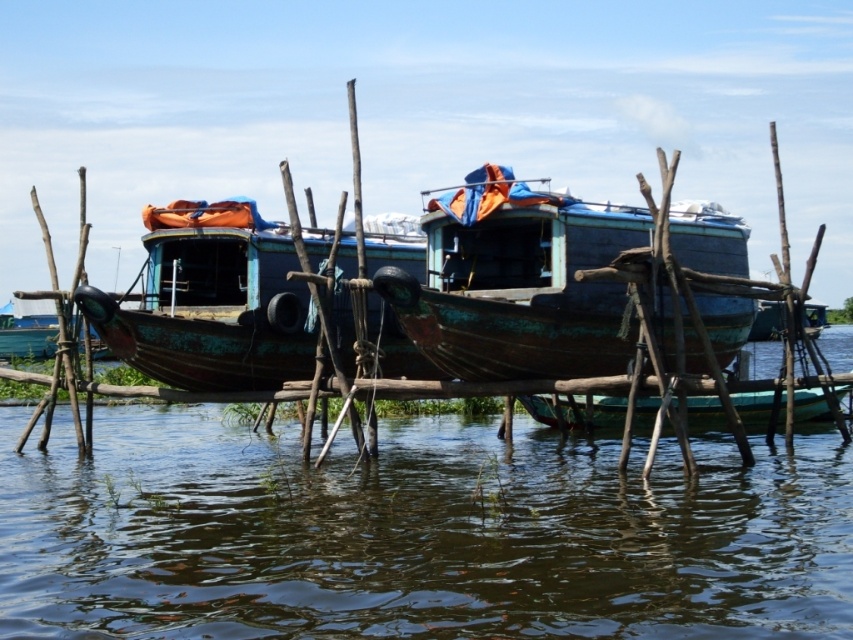
Which of these two, rusty wood boat at center or rusty metal boat at center, stands taller?

rusty metal boat at center is taller.

The width and height of the screenshot is (853, 640). What do you see at coordinates (520, 291) in the screenshot?
I see `rusty wood boat at center` at bounding box center [520, 291].

Where is `rusty wood boat at center`? rusty wood boat at center is located at coordinates (520, 291).

Does brown murky water at center appear on the right side of rusty wood boat at center?

Incorrect, brown murky water at center is not on the right side of rusty wood boat at center.

Is point (637, 436) positioned behind point (474, 369)?

Yes, it is.

Find the location of a particular element. The width and height of the screenshot is (853, 640). brown murky water at center is located at coordinates (416, 532).

Identify the location of brown murky water at center. (416, 532).

Who is higher up, brown murky water at center or rusty metal boat at center?

rusty metal boat at center is higher up.

Can you confirm if brown murky water at center is shorter than rusty metal boat at center?

No, brown murky water at center is not shorter than rusty metal boat at center.

This screenshot has height=640, width=853. Identify the location of brown murky water at center. (416, 532).